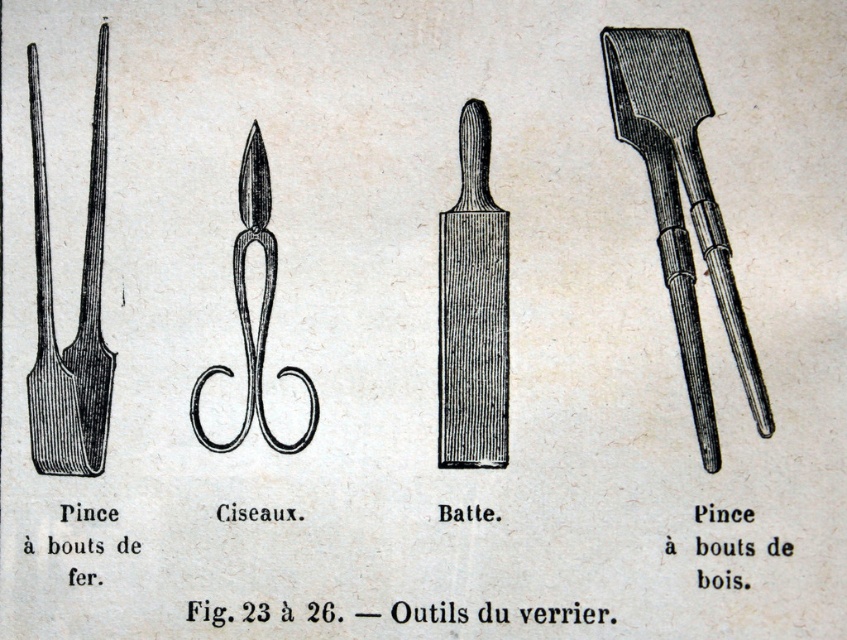
Which is below, wooden bat at center or black wood scissors at center?

black wood scissors at center is below.

Which is more to the left, wooden bat at center or black wood scissors at center?

black wood scissors at center is more to the left.

Does point (505, 243) come behind point (309, 429)?

No, (505, 243) is in front of (309, 429).

Find the location of `wooden bat at center`. wooden bat at center is located at coordinates (473, 308).

Who is more forward, (688,65) or (69,388)?

Point (69,388) is more forward.

Can you confirm if wooden tongs at right is bigger than matte black tongs at left?

Correct, wooden tongs at right is larger in size than matte black tongs at left.

Is point (684, 256) farther from camera compared to point (48, 440)?

Yes, it is behind point (48, 440).

The image size is (847, 640). I want to click on wooden tongs at right, so click(679, 205).

The width and height of the screenshot is (847, 640). What do you see at coordinates (78, 316) in the screenshot?
I see `matte black tongs at left` at bounding box center [78, 316].

Does matte black tongs at left have a greater width compared to black wood scissors at center?

No, matte black tongs at left is not wider than black wood scissors at center.

The image size is (847, 640). Identify the location of matte black tongs at left. (78, 316).

Where is `matte black tongs at left`? matte black tongs at left is located at coordinates click(78, 316).